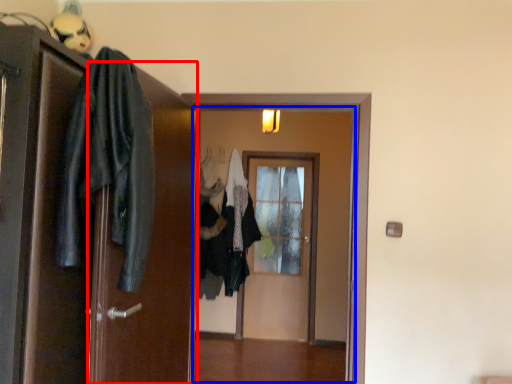
Question: Among these objects, which one is nearest to the camera, screen door (highlighted by a red box) or door (highlighted by a blue box)?

Choices:
 (A) screen door
 (B) door

Answer: (A)